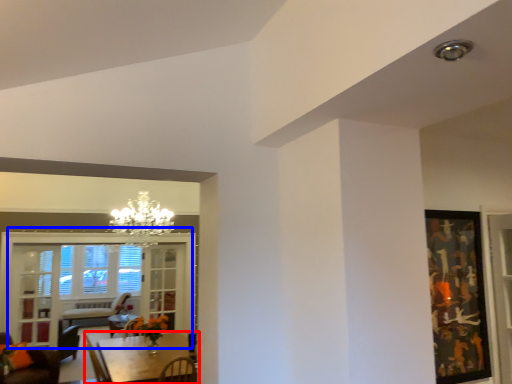
Question: Which point is closer to the camera, table (highlighted by a red box) or window (highlighted by a blue box)?

Choices:
 (A) table
 (B) window

Answer: (A)